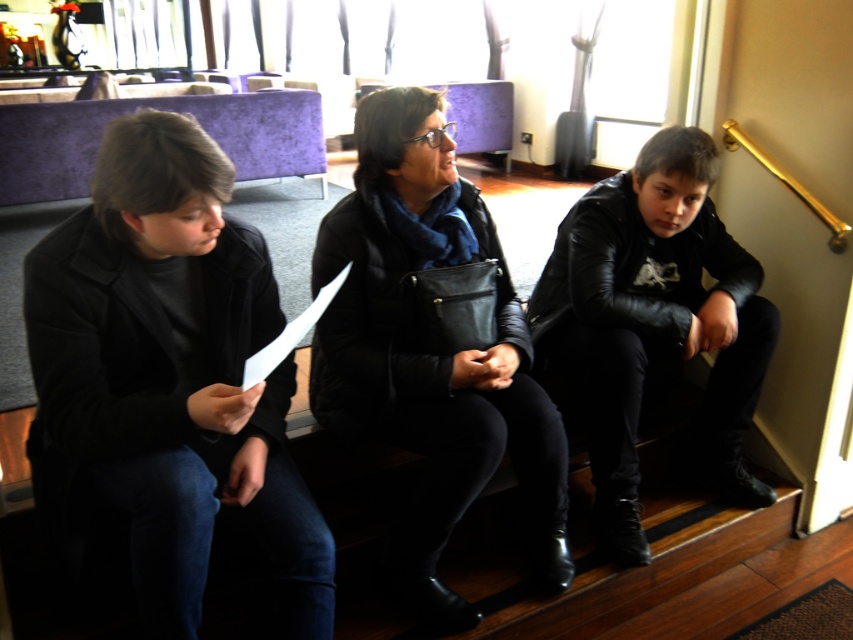
Question: Does black matte jacket at center have a smaller size compared to black leather jacket at right?

Choices:
 (A) no
 (B) yes

Answer: (B)

Question: Which of the following is the closest to the observer?

Choices:
 (A) black matte jacket at center
 (B) black leather jacket at right

Answer: (A)

Question: Which of the following is the farthest from the observer?

Choices:
 (A) (372, 358)
 (B) (635, 492)

Answer: (B)

Question: Does black matte jacket at center appear on the right side of black leather jacket at right?

Choices:
 (A) no
 (B) yes

Answer: (A)

Question: Which of the following is the farthest from the observer?

Choices:
 (A) black leather jacket at right
 (B) black matte jacket at center

Answer: (A)

Question: Is black matte jacket at center positioned behind black leather jacket at right?

Choices:
 (A) yes
 (B) no

Answer: (B)